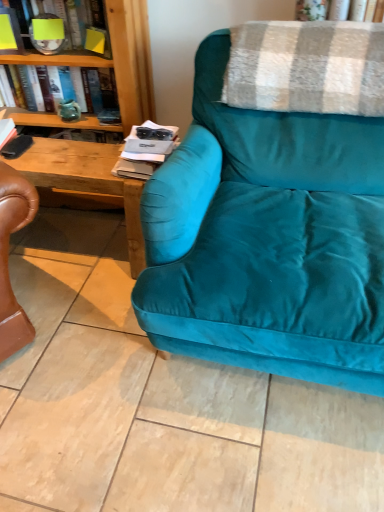
Question: Does green glass vase at upper left, acting as the 1th book starting from the bottom, have a greater width compared to plaid woolen blanket at upper right?

Choices:
 (A) yes
 (B) no

Answer: (B)

Question: Is green glass vase at upper left, acting as the 1th book starting from the bottom, closer to camera compared to plaid woolen blanket at upper right?

Choices:
 (A) yes
 (B) no

Answer: (B)

Question: From a real-world perspective, is green glass vase at upper left, which appears as the second book when viewed from the top, physically above plaid woolen blanket at upper right?

Choices:
 (A) yes
 (B) no

Answer: (B)

Question: Does green glass vase at upper left, acting as the 1th book starting from the bottom, have a lesser width compared to plaid woolen blanket at upper right?

Choices:
 (A) no
 (B) yes

Answer: (B)

Question: From the image's perspective, is green glass vase at upper left, which appears as the second book when viewed from the top, above plaid woolen blanket at upper right?

Choices:
 (A) yes
 (B) no

Answer: (A)

Question: Considering the positions of matte black magazine at center and yellow paper at upper left, the 2th book when ordered from bottom to top, in the image, is matte black magazine at center bigger or smaller than yellow paper at upper left, the 2th book when ordered from bottom to top,?

Choices:
 (A) big
 (B) small

Answer: (B)

Question: From a real-world perspective, is matte black magazine at center above or below yellow paper at upper left, arranged as the 1th book when viewed from the top?

Choices:
 (A) above
 (B) below

Answer: (B)

Question: In terms of width, does matte black magazine at center look wider or thinner when compared to yellow paper at upper left, arranged as the 1th book when viewed from the top?

Choices:
 (A) wide
 (B) thin

Answer: (A)

Question: From the image's perspective, is matte black magazine at center positioned above or below yellow paper at upper left, the 2th book when ordered from bottom to top?

Choices:
 (A) below
 (B) above

Answer: (A)

Question: Does point (266, 211) appear closer or farther from the camera than point (132, 163)?

Choices:
 (A) closer
 (B) farther

Answer: (A)

Question: From their relative heights in the image, would you say teal velvet couch at center is taller or shorter than matte black magazine at center?

Choices:
 (A) short
 (B) tall

Answer: (B)

Question: From a real-world perspective, is teal velvet couch at center positioned above or below matte black magazine at center?

Choices:
 (A) above
 (B) below

Answer: (B)

Question: In terms of width, does teal velvet couch at center look wider or thinner when compared to matte black magazine at center?

Choices:
 (A) thin
 (B) wide

Answer: (B)

Question: Is plaid woolen blanket at upper right inside the boundaries of teal velvet couch at center, or outside?

Choices:
 (A) inside
 (B) outside

Answer: (A)

Question: In the image, is plaid woolen blanket at upper right on the left side or the right side of teal velvet couch at center?

Choices:
 (A) left
 (B) right

Answer: (B)